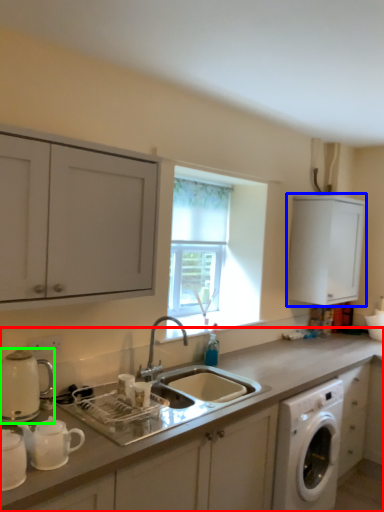
Question: Estimate the real-world distances between objects in this image. Which object is farther from countertop (highlighted by a red box), cabinetry (highlighted by a blue box) or appliance (highlighted by a green box)?

Choices:
 (A) cabinetry
 (B) appliance

Answer: (A)